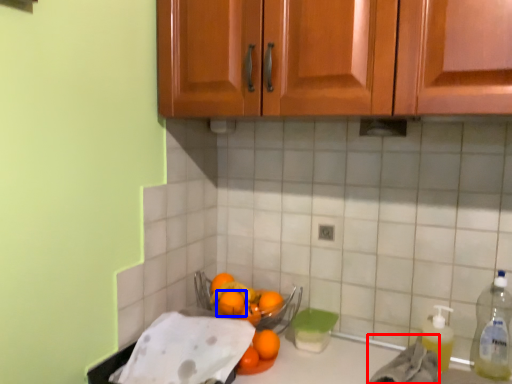
Question: Which object appears farthest to the camera in this image, material (highlighted by a red box) or orange (highlighted by a blue box)?

Choices:
 (A) material
 (B) orange

Answer: (B)